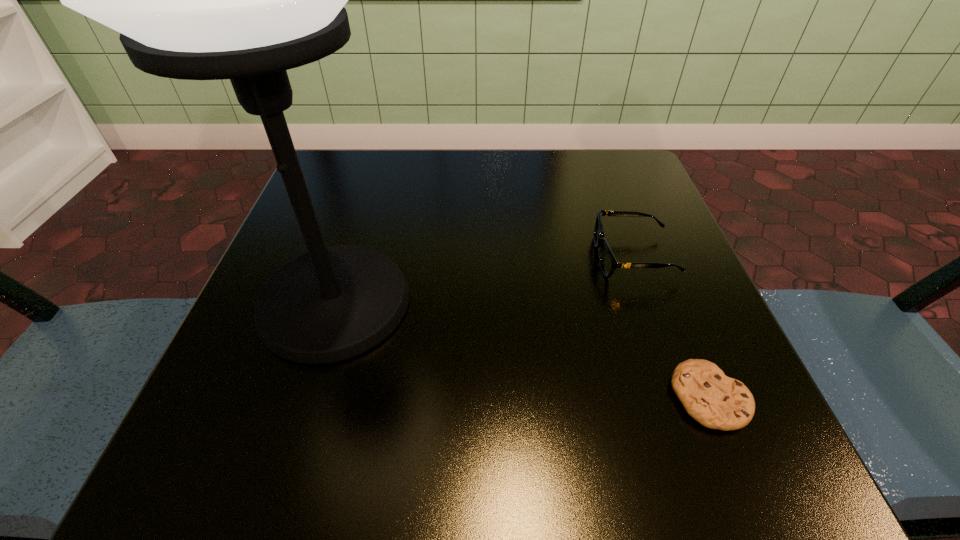
What are the coordinates of `table lamp` in the screenshot? It's located at (246, 0).

Find the location of a particular element. This screenshot has width=960, height=540. the leftmost object is located at coordinates (246, 0).

At what (x,y) coordinates should I click in order to perform the action: click on the second shortest object. Please return your answer as a coordinate pair (x, y). The width and height of the screenshot is (960, 540). Looking at the image, I should click on (608, 263).

Image resolution: width=960 pixels, height=540 pixels. Identify the location of cookie. (716, 401).

Identify the location of free location located on the right of the leftmost object. (476, 303).

Where is `vacant space located 0.180m on the front-facing side of the second shortest object`? This screenshot has width=960, height=540. vacant space located 0.180m on the front-facing side of the second shortest object is located at coordinates (493, 256).

Where is `vacant position located 0.130m on the front-facing side of the second shortest object`? Image resolution: width=960 pixels, height=540 pixels. vacant position located 0.130m on the front-facing side of the second shortest object is located at coordinates (521, 256).

Where is `free space located on the front-facing side of the second shortest object`? free space located on the front-facing side of the second shortest object is located at coordinates click(x=493, y=256).

At what (x,y) coordinates should I click in order to perform the action: click on vacant space situated on the left of the shortest object. Please return your answer as a coordinate pair (x, y). This screenshot has width=960, height=540. Looking at the image, I should click on (516, 398).

Where is `object present at the near edge`? This screenshot has height=540, width=960. object present at the near edge is located at coordinates click(716, 401).